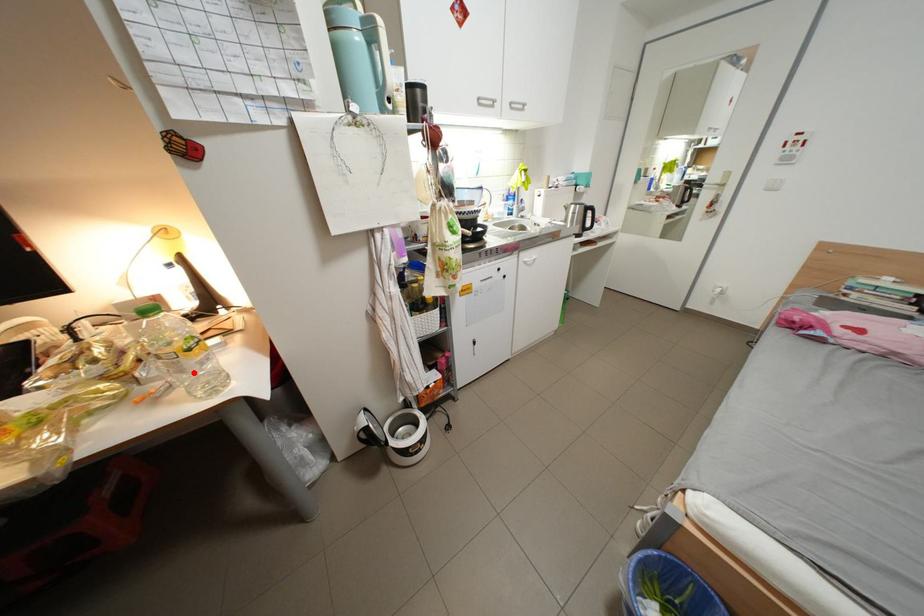
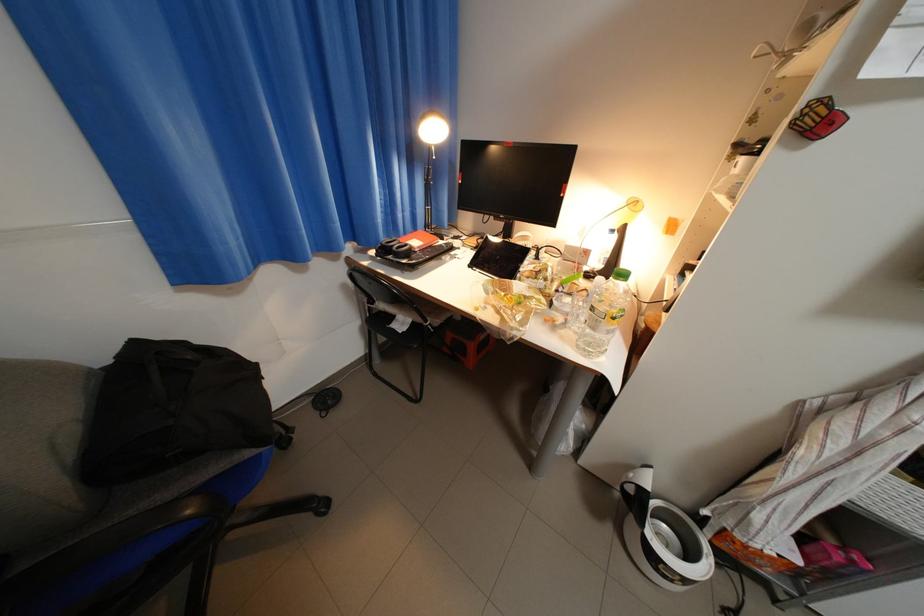
In the second image, find the point that corresponds to the highlighted location in the first image.

(605, 330)